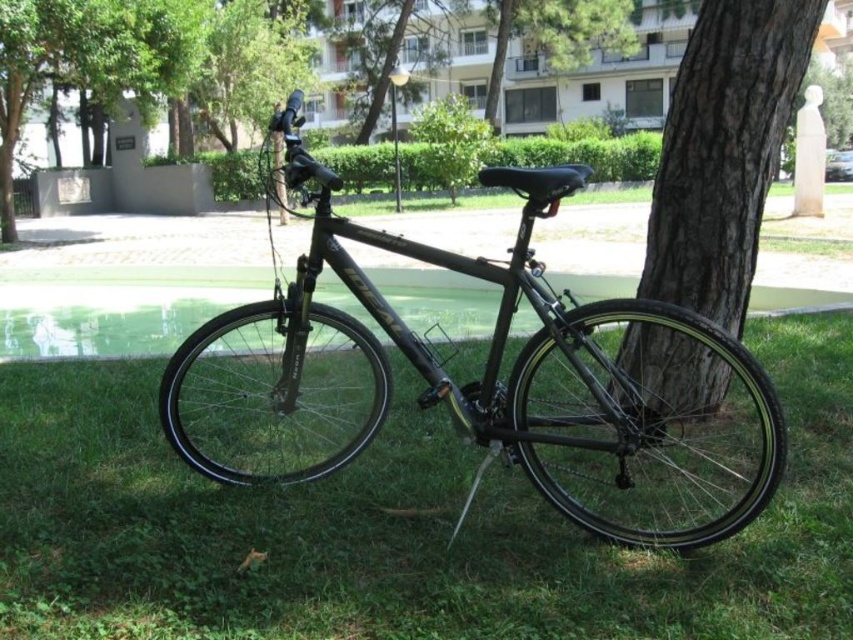
Does green grass at lower center have a smaller size compared to matte black bicycle at center?

Indeed, green grass at lower center has a smaller size compared to matte black bicycle at center.

Which is more to the right, green grass at lower center or matte black bicycle at center?

From the viewer's perspective, green grass at lower center appears more on the right side.

Where is `green grass at lower center`? green grass at lower center is located at coordinates (395, 528).

Who is positioned more to the left, matte black bicycle at center or brown rough bark at center?

matte black bicycle at center

Is point (192, 360) positioned behind point (737, 220)?

No, it is in front of (737, 220).

The height and width of the screenshot is (640, 853). I want to click on matte black bicycle at center, so click(463, 385).

Is the position of green grass at lower center more distant than that of brown rough bark at center?

No, it is not.

Who is higher up, green grass at lower center or brown rough bark at center?

brown rough bark at center is higher up.

The image size is (853, 640). I want to click on green grass at lower center, so click(x=395, y=528).